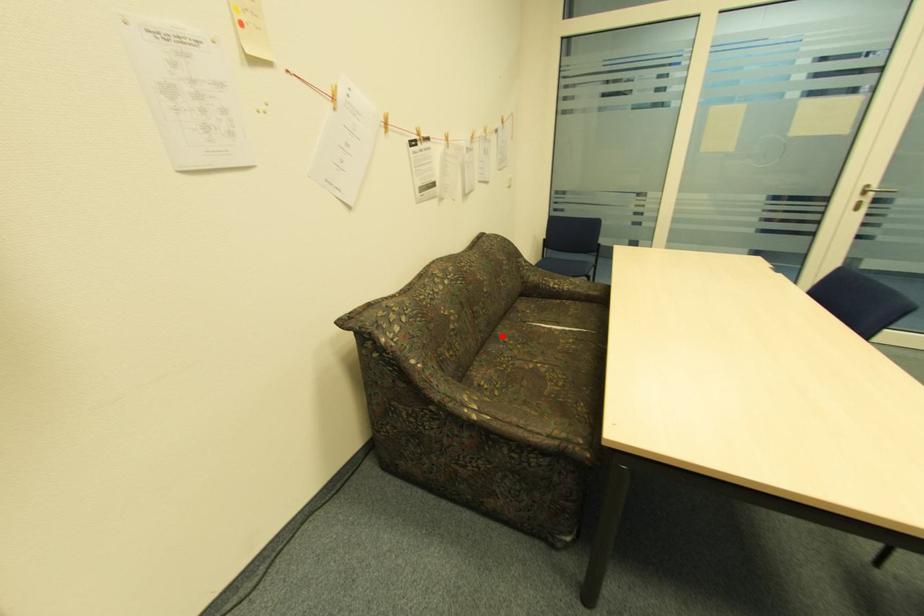
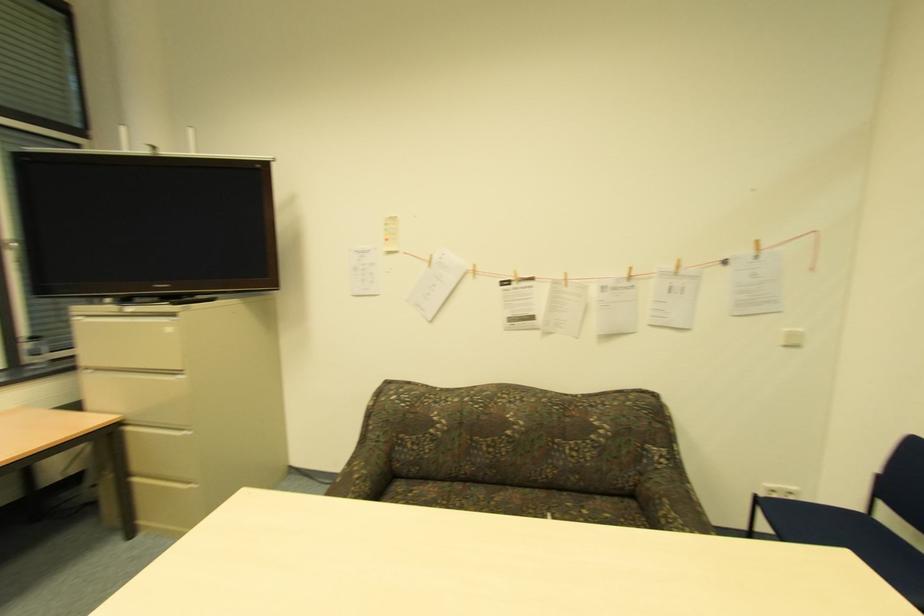
The point at the highlighted location is marked in the first image. Where is the corresponding point in the second image?

(505, 493)